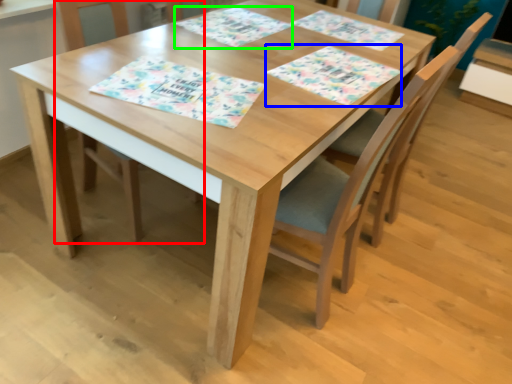
Question: Which object is positioned farthest from chair (highlighted by a red box)? Select from place mat (highlighted by a blue box) and place mat (highlighted by a green box).

Choices:
 (A) place mat
 (B) place mat

Answer: (A)